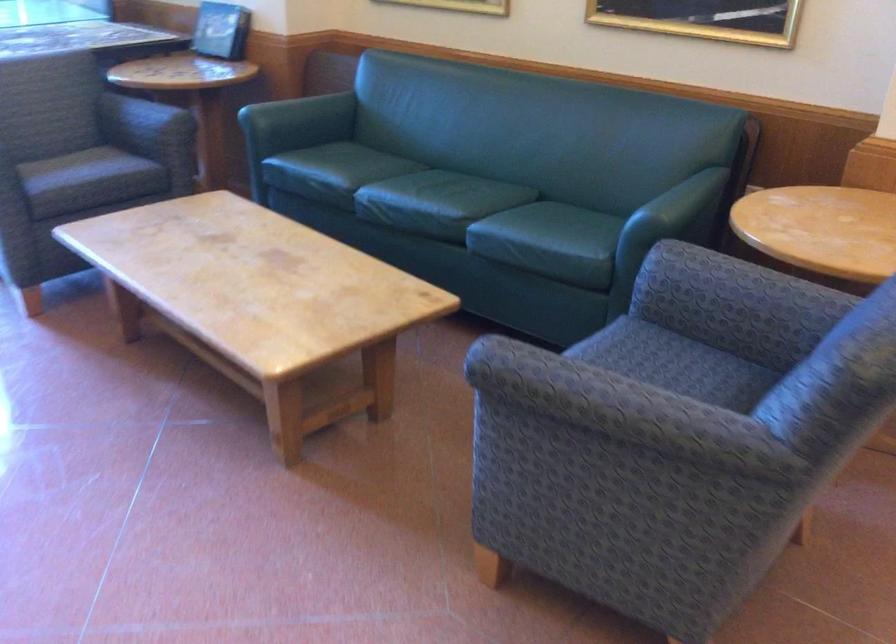
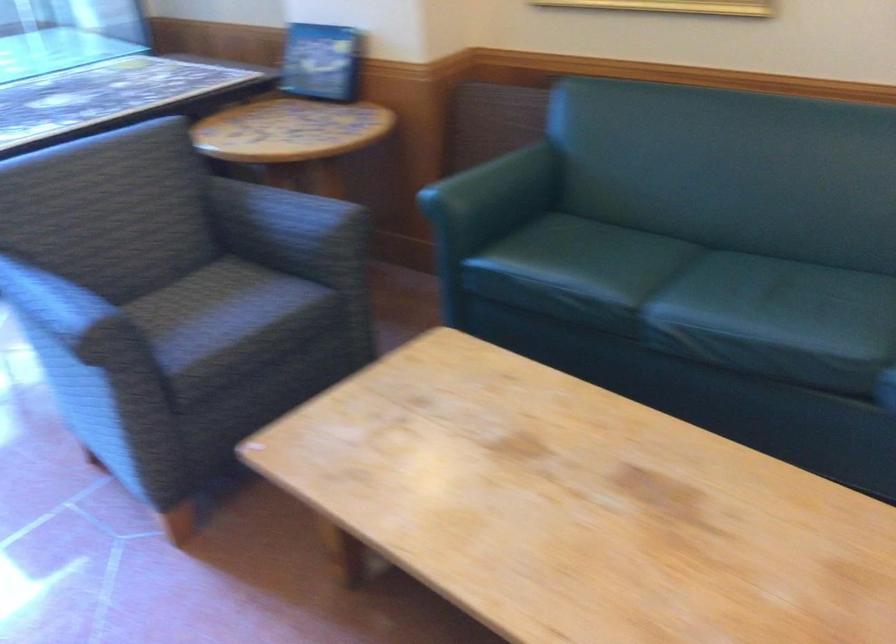
Find the pixel in the second image that matches the point at 394,180 in the first image.

(679, 283)